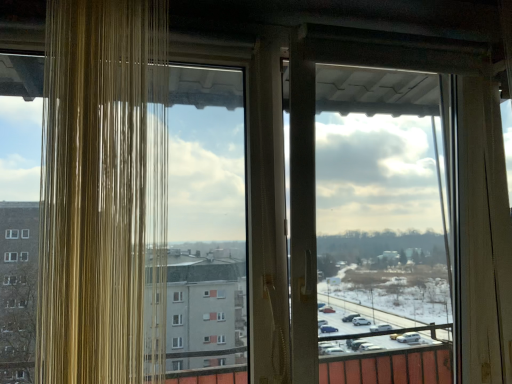
Question: Is the depth of transparent plastic screen door at center less than that of translucent glass window at left?

Choices:
 (A) yes
 (B) no

Answer: (B)

Question: Is transparent plastic screen door at center to the left of translucent glass window at left from the viewer's perspective?

Choices:
 (A) yes
 (B) no

Answer: (B)

Question: Is transparent plastic screen door at center behind translucent glass window at left?

Choices:
 (A) yes
 (B) no

Answer: (A)

Question: Can you confirm if transparent plastic screen door at center is wider than translucent glass window at left?

Choices:
 (A) yes
 (B) no

Answer: (A)

Question: Is transparent plastic screen door at center facing towards translucent glass window at left?

Choices:
 (A) yes
 (B) no

Answer: (B)

Question: Is transparent plastic screen door at center to the right of translucent glass window at left from the viewer's perspective?

Choices:
 (A) no
 (B) yes

Answer: (B)

Question: From a real-world perspective, is translucent glass window at left under transparent plastic screen door at center?

Choices:
 (A) no
 (B) yes

Answer: (A)

Question: Is the depth of translucent glass window at left greater than that of transparent plastic screen door at center?

Choices:
 (A) yes
 (B) no

Answer: (B)

Question: Is translucent glass window at left oriented away from transparent plastic screen door at center?

Choices:
 (A) yes
 (B) no

Answer: (B)

Question: Is translucent glass window at left smaller than transparent plastic screen door at center?

Choices:
 (A) no
 (B) yes

Answer: (B)

Question: Is translucent glass window at left next to transparent plastic screen door at center?

Choices:
 (A) no
 (B) yes

Answer: (A)

Question: From a real-world perspective, does translucent glass window at left stand above transparent plastic screen door at center?

Choices:
 (A) no
 (B) yes

Answer: (B)

Question: From the image's perspective, is transparent plastic screen door at center above or below translucent glass window at left?

Choices:
 (A) below
 (B) above

Answer: (A)